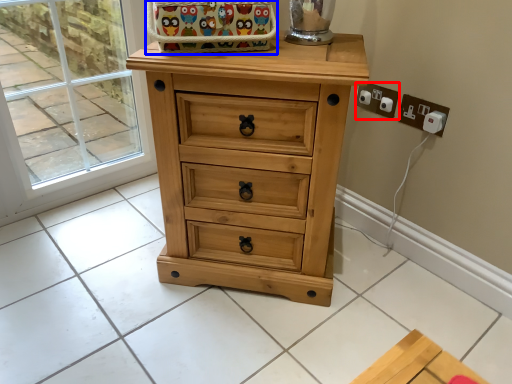
Question: Which object is further to the camera taking this photo, electric outlet (highlighted by a red box) or basket (highlighted by a blue box)?

Choices:
 (A) electric outlet
 (B) basket

Answer: (A)